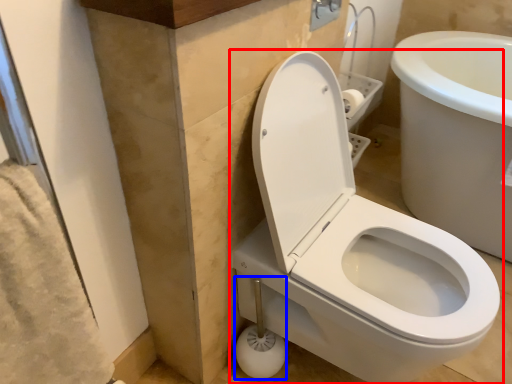
Question: Which object appears closest to the camera in this image, toilet (highlighted by a red box) or shower (highlighted by a blue box)?

Choices:
 (A) toilet
 (B) shower

Answer: (A)